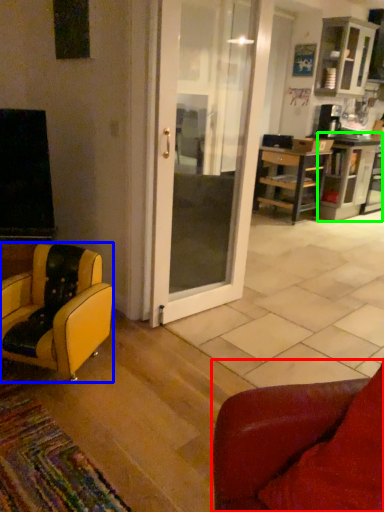
Question: Estimate the real-world distances between objects in this image. Which object is closer to chair (highlighted by a red box), chair (highlighted by a blue box) or shelf (highlighted by a green box)?

Choices:
 (A) chair
 (B) shelf

Answer: (A)